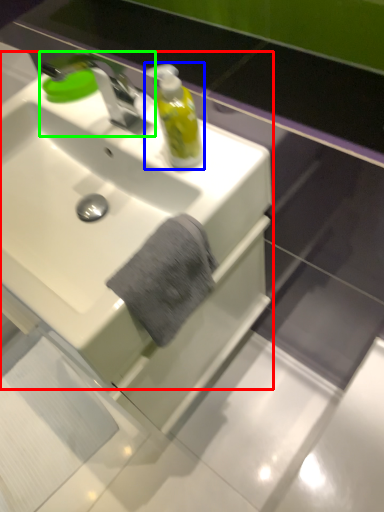
Question: Considering the real-world distances, which object is closest to sink (highlighted by a red box)? mouthwash (highlighted by a blue box) or tap (highlighted by a green box).

Choices:
 (A) mouthwash
 (B) tap

Answer: (B)